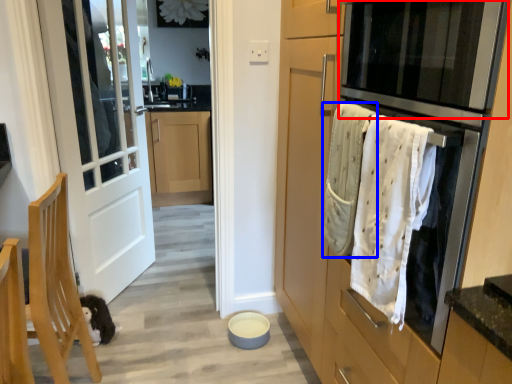
Question: Which object is further to the camera taking this photo, oven (highlighted by a red box) or bath towel (highlighted by a blue box)?

Choices:
 (A) oven
 (B) bath towel

Answer: (B)